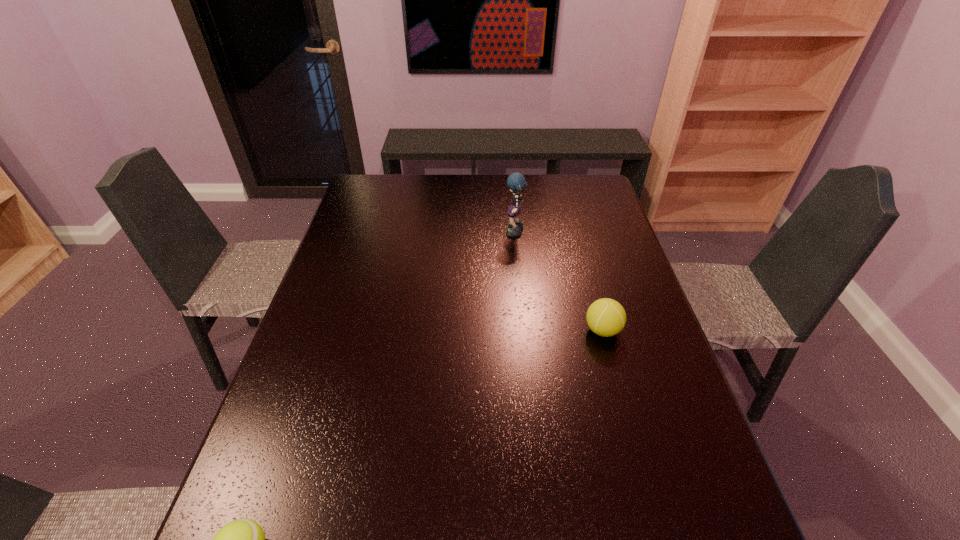
Locate an element on the screen. vacant space at the left edge of the desktop is located at coordinates (387, 213).

Find the location of a particular element. vacant space at the far left corner is located at coordinates (352, 199).

The width and height of the screenshot is (960, 540). I want to click on free point at the far right corner, so (564, 183).

The height and width of the screenshot is (540, 960). What are the coordinates of `vacant area that lies between the farther tennis ball and the farthest object` in the screenshot? It's located at (559, 282).

Where is `unoccupied area between the tallest object and the farther tennis ball`? The image size is (960, 540). unoccupied area between the tallest object and the farther tennis ball is located at coordinates (559, 282).

You are a GUI agent. You are given a task and a screenshot of the screen. Output one action in this format:
    pyautogui.click(x=<x>, y=<y>)
    Task: Click on the unoccupied area between the farther tennis ball and the second object from left to right
    Image resolution: width=960 pixels, height=540 pixels.
    Given the screenshot: What is the action you would take?
    pyautogui.click(x=559, y=282)

Locate an element on the screen. The height and width of the screenshot is (540, 960). free space that is in between the right tennis ball and the second object from left to right is located at coordinates (559, 282).

Image resolution: width=960 pixels, height=540 pixels. I want to click on object that stands as the closest to the second nearest object, so click(516, 182).

Select which object is the second closest to the nearer tennis ball. Please provide its 2D coordinates. Your answer should be formatted as a tuple, i.e. [(x, y)], where the tuple contains the x and y coordinates of a point satisfying the conditions above.

[(516, 182)]

Where is `vacant space that satisfies the following two spatial constraints: 1. on the front-facing side of the rag doll; 2. on the left side of the right tennis ball`? vacant space that satisfies the following two spatial constraints: 1. on the front-facing side of the rag doll; 2. on the left side of the right tennis ball is located at coordinates (524, 330).